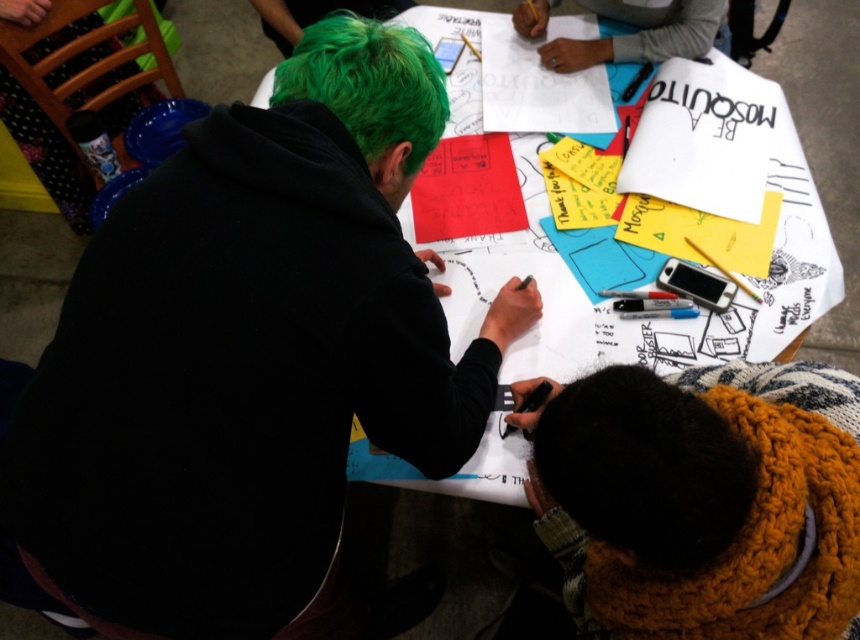
Is point (722, 323) less distant than point (341, 56)?

That is False.

What do you see at coordinates (647, 320) in the screenshot? The image size is (860, 640). I see `white paper at center` at bounding box center [647, 320].

Image resolution: width=860 pixels, height=640 pixels. What are the coordinates of `white paper at center` in the screenshot? It's located at (647, 320).

Measure the distance between green matte hair at upper left and gray fabric at upper center.

24.53 inches

Does green matte hair at upper left appear under gray fabric at upper center?

Yes, green matte hair at upper left is below gray fabric at upper center.

Who is more distant from viewer, (375, 74) or (578, 54)?

The point (578, 54) is more distant.

Where is `green matte hair at upper left`? This screenshot has width=860, height=640. green matte hair at upper left is located at coordinates (369, 83).

Which of these two, white paper at center or brown fuzzy hat at lower center, stands shorter?

Standing shorter between the two is brown fuzzy hat at lower center.

Between white paper at center and brown fuzzy hat at lower center, which one is positioned lower?

brown fuzzy hat at lower center

Where is `white paper at center`? This screenshot has height=640, width=860. white paper at center is located at coordinates (647, 320).